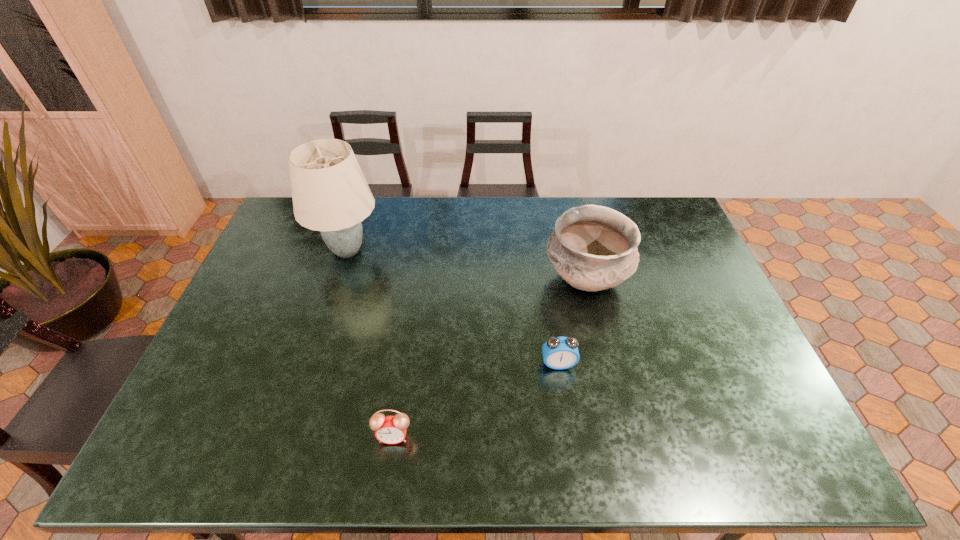
Identify the location of object that is at the far edge. (330, 194).

At what (x,y) coordinates should I click in order to perform the action: click on object situated at the near edge. Please return your answer as a coordinate pair (x, y). Looking at the image, I should click on (389, 429).

Find the location of a particular element. The image size is (960, 540). object at the left edge is located at coordinates (330, 194).

This screenshot has width=960, height=540. I want to click on object that is positioned at the far left corner, so click(x=330, y=194).

Image resolution: width=960 pixels, height=540 pixels. Find the location of `free space at the far edge of the desktop`. free space at the far edge of the desktop is located at coordinates (380, 216).

The width and height of the screenshot is (960, 540). Find the location of `free spot at the near edge of the desktop`. free spot at the near edge of the desktop is located at coordinates (530, 465).

This screenshot has width=960, height=540. In order to click on vacant space at the left edge in this screenshot , I will do `click(204, 413)`.

The height and width of the screenshot is (540, 960). In the image, there is a desktop. Identify the location of vacant area at the right edge. (665, 238).

Image resolution: width=960 pixels, height=540 pixels. Find the location of `vacant space that is in between the lampshade and the pottery`. vacant space that is in between the lampshade and the pottery is located at coordinates (467, 265).

Locate an element on the screen. free space between the nearest object and the lampshade is located at coordinates (371, 343).